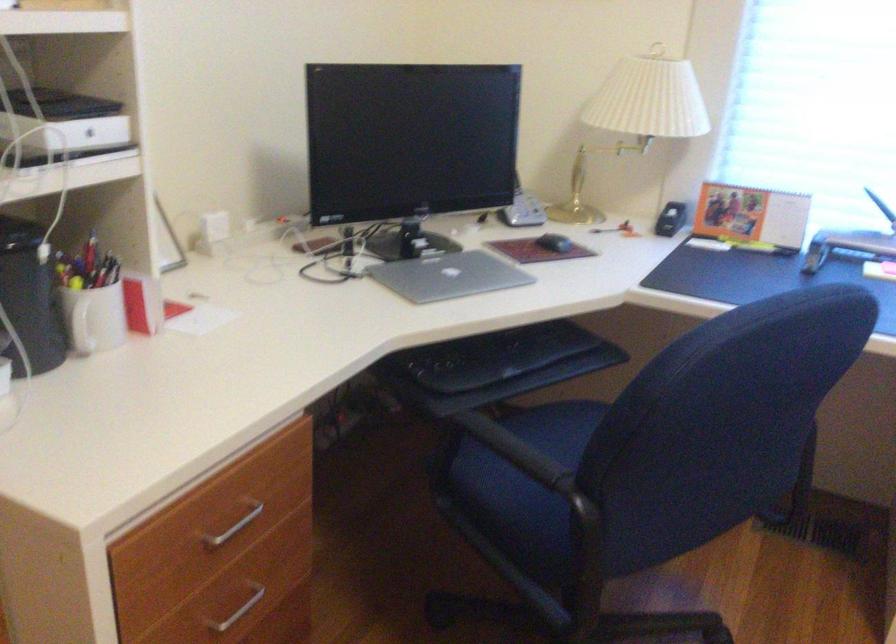
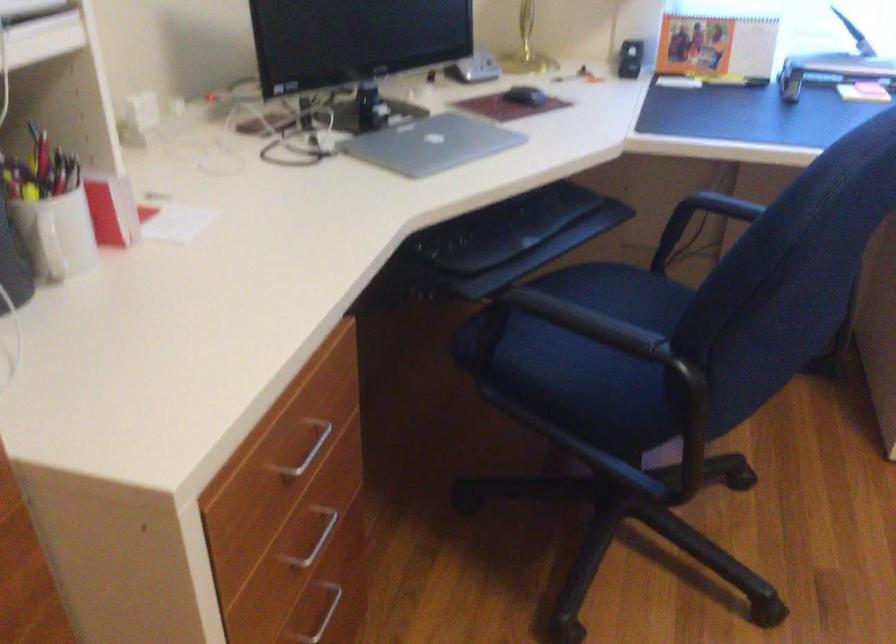
In a continuous first-person perspective shot, in which direction is the camera moving?

The cameraman walked toward left, forward.